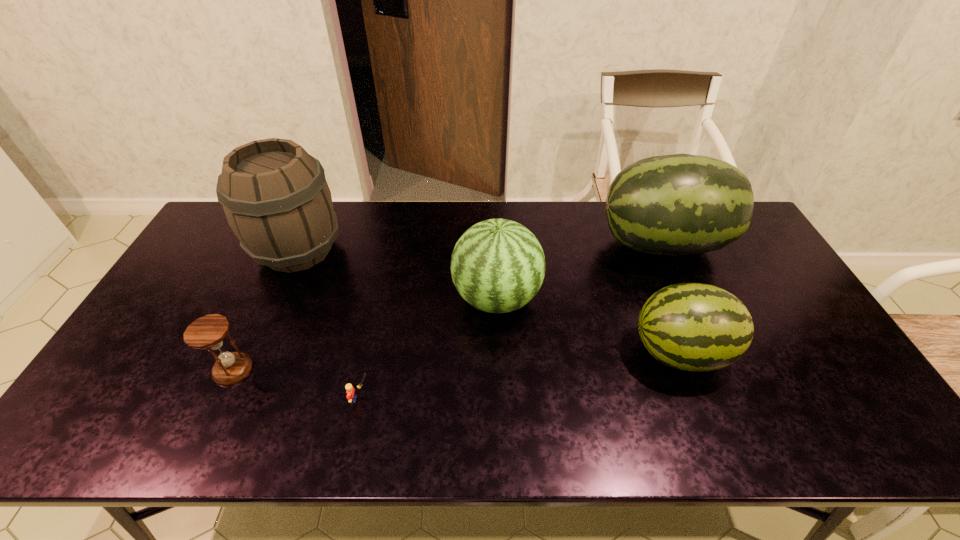
In the image, there is a desktop. Where is `vacant area at the near left corner`? vacant area at the near left corner is located at coordinates (89, 423).

You are a GUI agent. You are given a task and a screenshot of the screen. Output one action in this format:
    pyautogui.click(x=<x>, y=<y>)
    Task: Click on the empty space that is in between the fourth object from left to right and the second shortest object
    This screenshot has width=960, height=540.
    Given the screenshot: What is the action you would take?
    pyautogui.click(x=365, y=334)

Where is `vacant space in between the nearest object and the wine bucket`? The height and width of the screenshot is (540, 960). vacant space in between the nearest object and the wine bucket is located at coordinates (329, 325).

What are the coordinates of `free space that is in between the hourglass and the wine bucket` in the screenshot? It's located at (266, 310).

You are a GUI agent. You are given a task and a screenshot of the screen. Output one action in this format:
    pyautogui.click(x=<x>, y=<y>)
    Task: Click on the blank region between the leftmost watermelon and the hourglass
    Image resolution: width=960 pixels, height=540 pixels.
    Given the screenshot: What is the action you would take?
    pyautogui.click(x=365, y=334)

The width and height of the screenshot is (960, 540). In order to click on vacant space that is in between the third object from right to left and the third shortest object in this screenshot , I will do `click(588, 325)`.

Find the location of a particular element. vacant region between the leftmost watermelon and the wine bucket is located at coordinates (397, 274).

This screenshot has height=540, width=960. Find the location of `empty space that is in between the wine bucket and the second shortest object`. empty space that is in between the wine bucket and the second shortest object is located at coordinates pos(266,310).

Identify which object is the second nearest to the wine bucket. Please provide its 2D coordinates. Your answer should be formatted as a tuple, i.e. [(x, y)], where the tuple contains the x and y coordinates of a point satisfying the conditions above.

[(498, 266)]

Identify which object is located as the third nearest to the Lego. Please provide its 2D coordinates. Your answer should be formatted as a tuple, i.e. [(x, y)], where the tuple contains the x and y coordinates of a point satisfying the conditions above.

[(276, 199)]